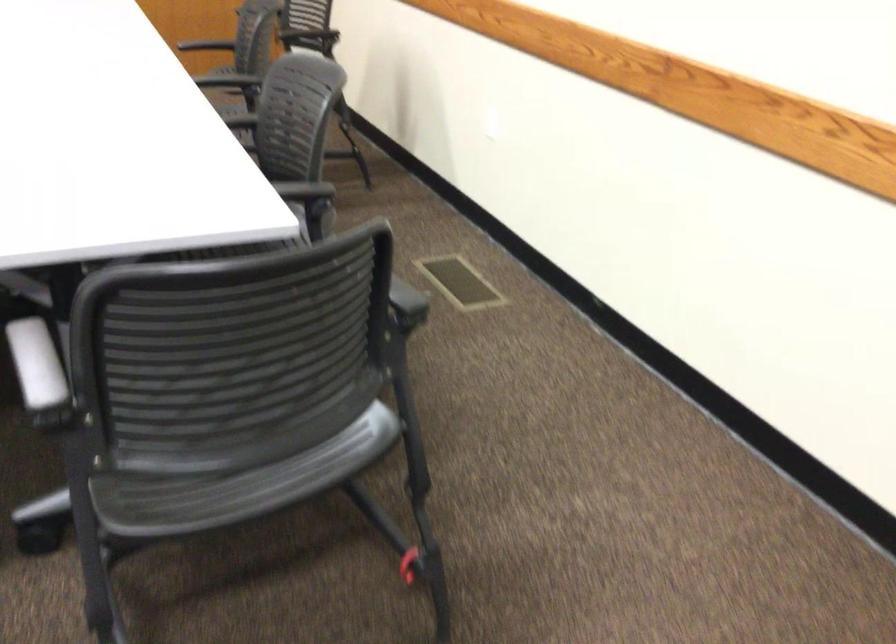
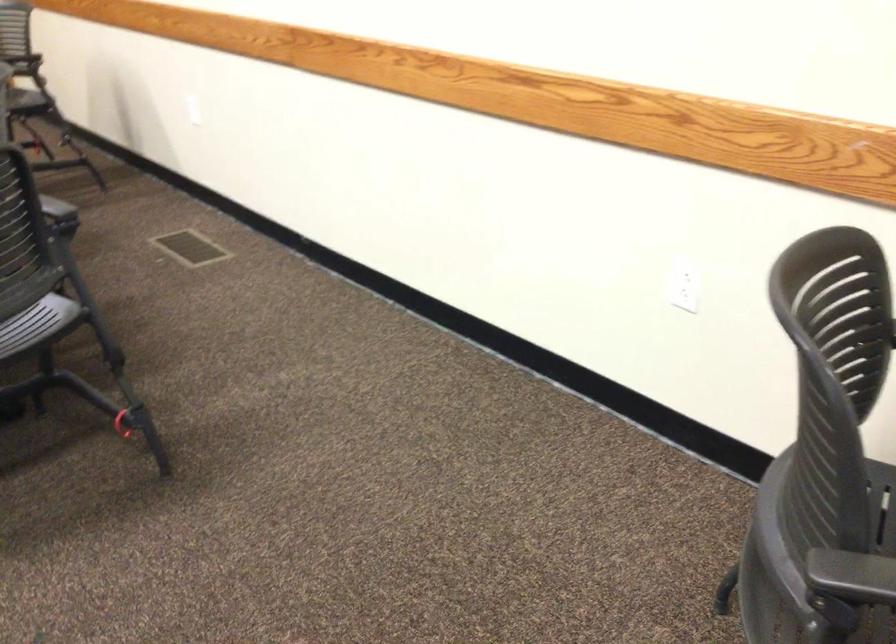
In the second image, find the point that corresponds to pixel 319 433 in the first image.

(37, 323)